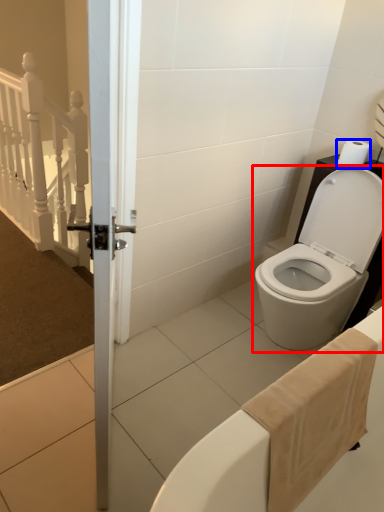
Question: Which of the following is the closest to the observer, toilet (highlighted by a red box) or toilet paper (highlighted by a blue box)?

Choices:
 (A) toilet
 (B) toilet paper

Answer: (A)